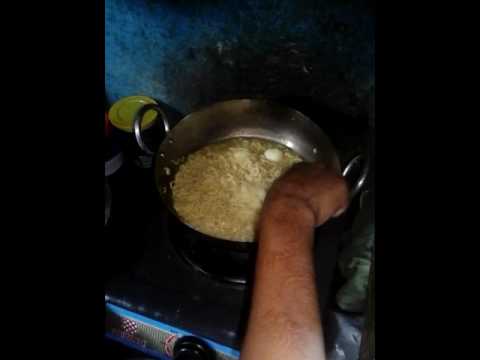
Locate an element on the screen. Image resolution: width=480 pixels, height=360 pixels. size of pot is located at coordinates (223, 239), (283, 101), (165, 138), (339, 162).